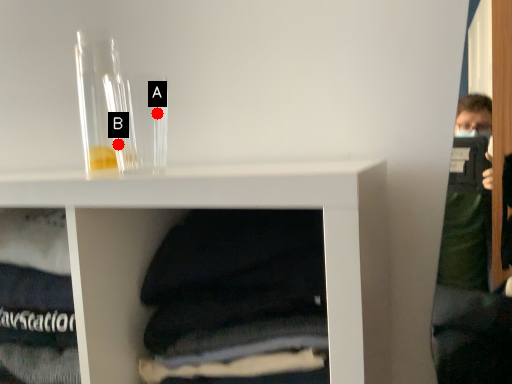
Question: Two points are circled on the image, labeled by A and B beside each circle. Which point is closer to the camera?

Choices:
 (A) A is closer
 (B) B is closer

Answer: (B)